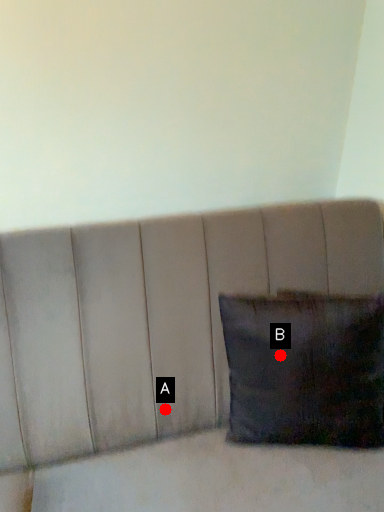
Question: Two points are circled on the image, labeled by A and B beside each circle. Which point is farther to the camera?

Choices:
 (A) A is further
 (B) B is further

Answer: (A)